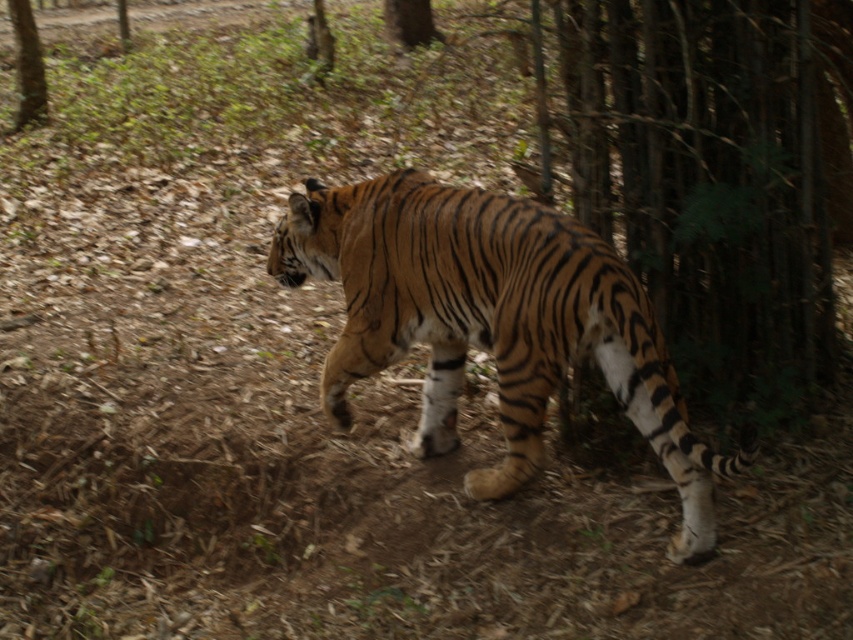
You are a wildlife photographer trying to capture the tiger in the forest. You notice two points in the image labeled as point (x=694, y=483) and point (x=18, y=125). If the tiger is moving from left to right, which point will the tiger reach first?

The tiger is moving from left to right. Point (x=694, y=483) is in front of point (x=18, y=125). Since the tiger is moving towards the right, it will reach point (x=694, y=483) first before reaching point (x=18, y=125).